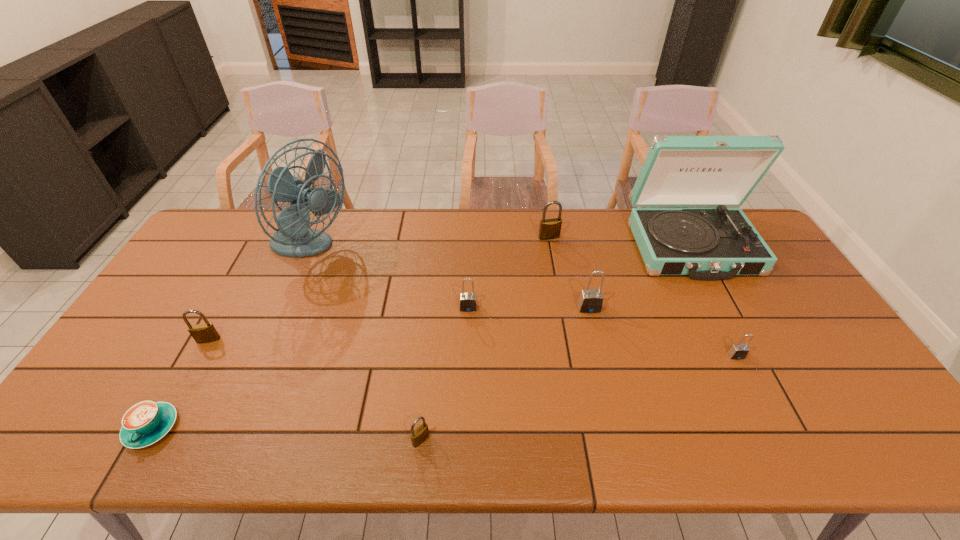
The height and width of the screenshot is (540, 960). I want to click on object that is at the right edge, so click(x=717, y=243).

Where is `object positioned at the near left corner`? object positioned at the near left corner is located at coordinates (146, 422).

Identify the location of object at the far right corner. (717, 243).

At what (x,y) coordinates should I click in order to perform the action: click on vacant space at the far edge. Please return your answer as a coordinate pair (x, y). Looking at the image, I should click on (592, 248).

Where is `vacant space at the near edge of the desktop`? vacant space at the near edge of the desktop is located at coordinates (204, 443).

The height and width of the screenshot is (540, 960). In order to click on free space at the left edge of the desktop in this screenshot , I will do `click(176, 305)`.

Where is `vacant space that is in between the second biggest brass padlock and the shortest object`? vacant space that is in between the second biggest brass padlock and the shortest object is located at coordinates (180, 383).

Find the location of a particular element. Image resolution: width=960 pixels, height=540 pixels. unoccupied area between the record player and the third object from right to left is located at coordinates (640, 277).

Identify the location of free spot between the fifth padlock from left to right and the fan. The width and height of the screenshot is (960, 540). point(449,279).

I want to click on free space between the fan and the leftmost brass padlock, so click(259, 294).